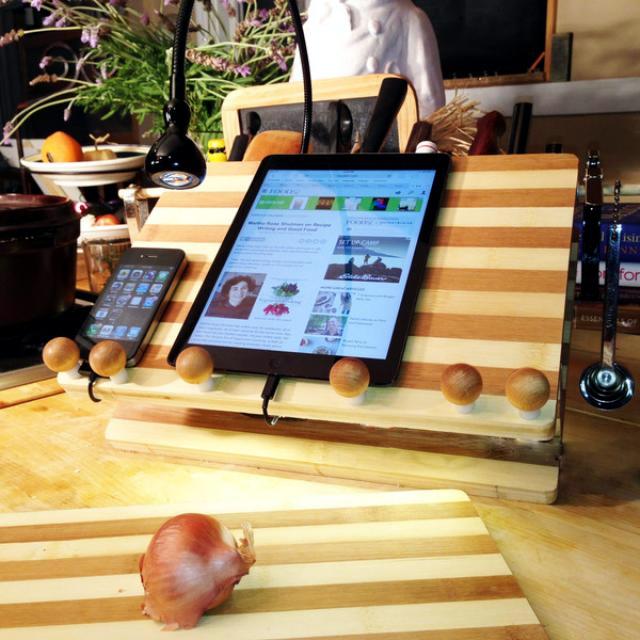
Find the location of `table`. table is located at coordinates (580, 575).